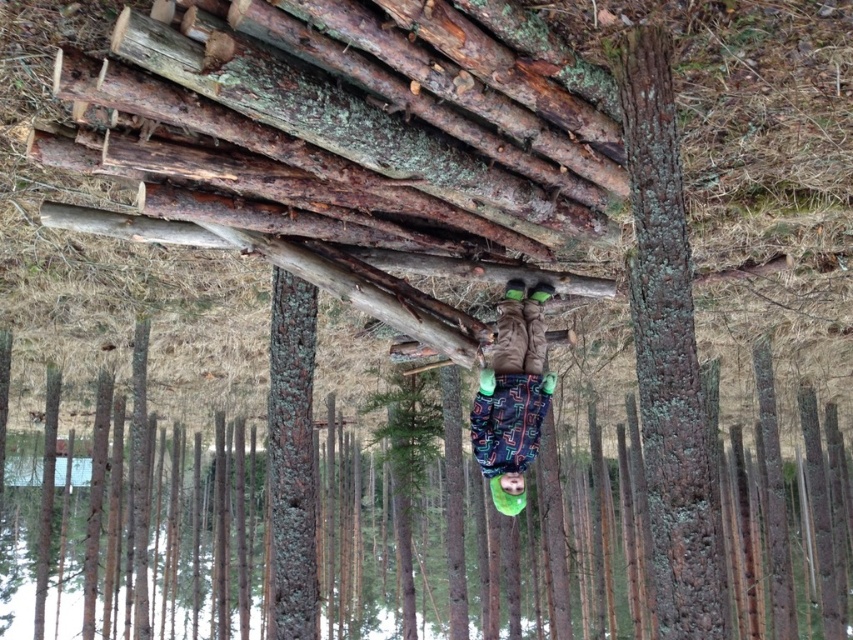
Question: In this image, where is dark brown rough bark at center located relative to green mossy bark at center?

Choices:
 (A) below
 (B) above

Answer: (B)

Question: Which object is the farthest from the dark brown fabric snowboard at center?

Choices:
 (A) green matte tree at center
 (B) green mossy bark at center
 (C) dark brown rough bark at center

Answer: (A)

Question: Is green mossy bark at center to the left of dark brown fabric snowboard at center from the viewer's perspective?

Choices:
 (A) yes
 (B) no

Answer: (A)

Question: Estimate the real-world distances between objects in this image. Which object is farther from the green mossy bark at center?

Choices:
 (A) dark brown fabric snowboard at center
 (B) green matte tree at center

Answer: (B)

Question: Which of the following is the farthest from the observer?

Choices:
 (A) dark brown fabric snowboard at center
 (B) green mossy bark at center

Answer: (A)

Question: Can you confirm if dark brown rough bark at center is wider than green mossy bark at center?

Choices:
 (A) yes
 (B) no

Answer: (B)